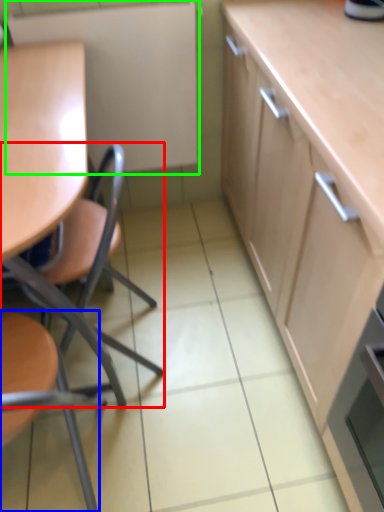
Question: Which object is the closest to the chair (highlighted by a red box)? Choose among these: chair (highlighted by a blue box) or appliance (highlighted by a green box).

Choices:
 (A) chair
 (B) appliance

Answer: (A)